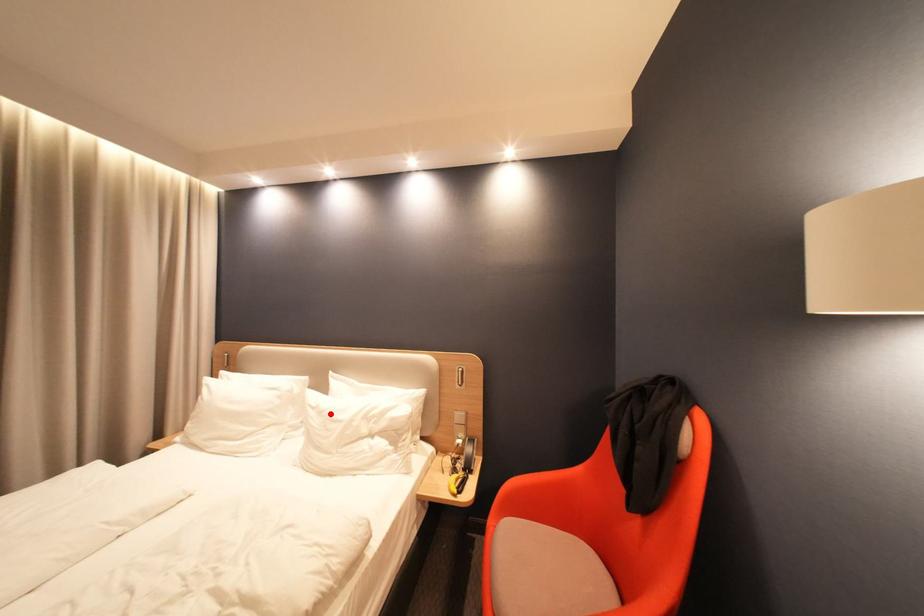
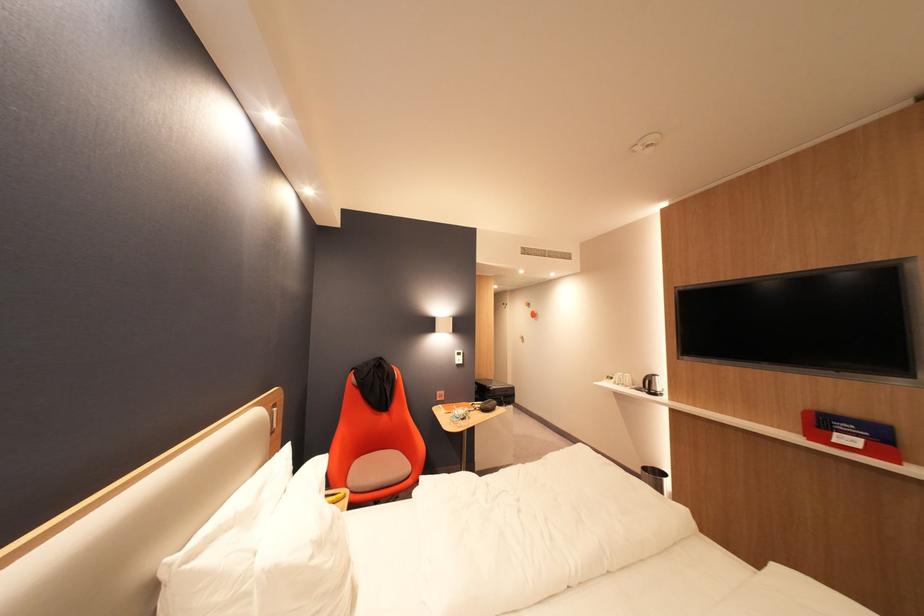
Where in the second image is the point corresponding to the highlighted location from the first image?

(330, 545)